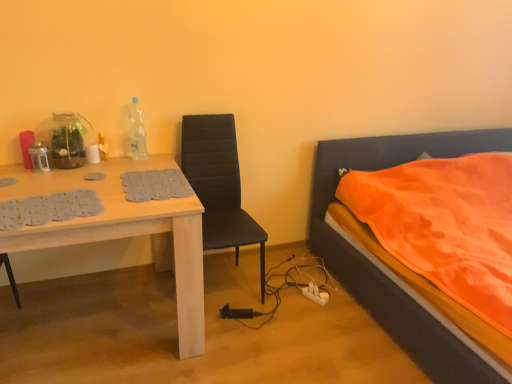
Question: Considering the relative sizes of white plastic power outlet at lower center and orange fabric bed at right in the image provided, is white plastic power outlet at lower center wider than orange fabric bed at right?

Choices:
 (A) yes
 (B) no

Answer: (B)

Question: Can you confirm if white plastic power outlet at lower center is thinner than orange fabric bed at right?

Choices:
 (A) no
 (B) yes

Answer: (B)

Question: Does white plastic power outlet at lower center have a smaller size compared to orange fabric bed at right?

Choices:
 (A) no
 (B) yes

Answer: (B)

Question: Can you confirm if white plastic power outlet at lower center is positioned to the right of orange fabric bed at right?

Choices:
 (A) yes
 (B) no

Answer: (B)

Question: From the image's perspective, is white plastic power outlet at lower center above orange fabric bed at right?

Choices:
 (A) no
 (B) yes

Answer: (A)

Question: In the image, is white plastic power outlet at lower center positioned in front of or behind orange fabric bed at right?

Choices:
 (A) front
 (B) behind

Answer: (B)

Question: Is white plastic power outlet at lower center wider or thinner than orange fabric bed at right?

Choices:
 (A) thin
 (B) wide

Answer: (A)

Question: In terms of height, does white plastic power outlet at lower center look taller or shorter compared to orange fabric bed at right?

Choices:
 (A) short
 (B) tall

Answer: (A)

Question: From a real-world perspective, is white plastic power outlet at lower center positioned above or below orange fabric bed at right?

Choices:
 (A) below
 (B) above

Answer: (A)

Question: Relative to orange fabric bed at right, is light wood table at left in front or behind?

Choices:
 (A) behind
 (B) front

Answer: (A)

Question: From a real-world perspective, is light wood table at left positioned above or below orange fabric bed at right?

Choices:
 (A) above
 (B) below

Answer: (B)

Question: Considering the positions of light wood table at left and orange fabric bed at right in the image, is light wood table at left taller or shorter than orange fabric bed at right?

Choices:
 (A) short
 (B) tall

Answer: (A)

Question: Considering the positions of light wood table at left and orange fabric bed at right in the image, is light wood table at left wider or thinner than orange fabric bed at right?

Choices:
 (A) thin
 (B) wide

Answer: (A)

Question: Considering their positions, is white plastic power outlet at lower center located in front of or behind black leather chair at center?

Choices:
 (A) front
 (B) behind

Answer: (B)

Question: Is point (313, 296) closer or farther from the camera than point (232, 158)?

Choices:
 (A) farther
 (B) closer

Answer: (A)